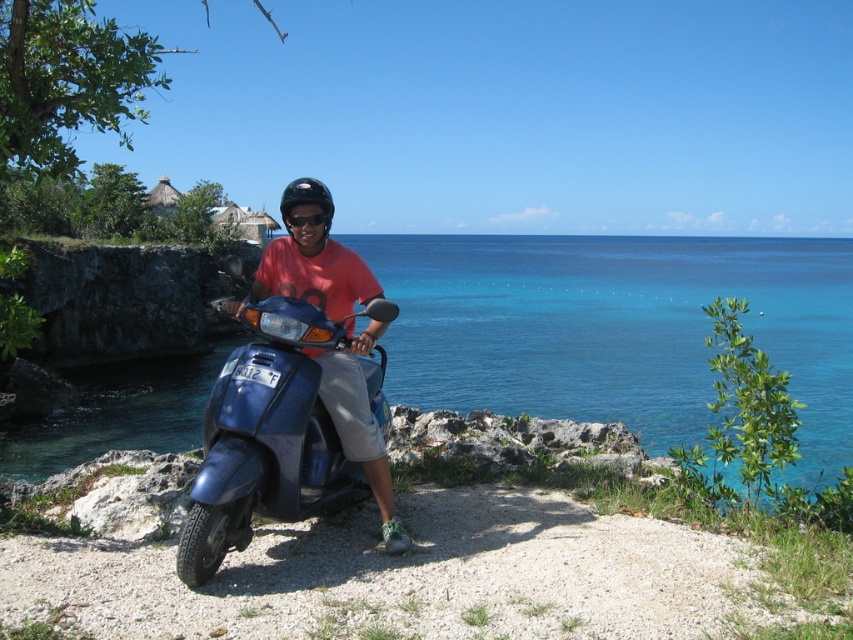
You are planning to cross the blue glossy water at center using the matte blue scooter at center. Given the scooter is 1.2 meters wide, will the scooter fit if the water is wider than the scooter?

The blue glossy water at center is wider than the matte blue scooter at center, so yes, the scooter will fit as the water is wider than the scooter.

You are a photographer trying to capture a photo of the blue glossy water at center and the matte blue scooter at center. Based on their positions, which object should you adjust your camera to focus on first if you want to include both in the frame without moving the camera?

The blue glossy water at center is to the right of matte blue scooter at center. Therefore, you should focus on the matte blue scooter at center first since it is closer to the left side, ensuring both objects remain in the frame when adjusting the camera angle.

You are a delivery person who needs to secure a package on the matte blue scooter at center. The black plastic goggles at center are in the way. Since you can only move one item, which one should you remove to make space for the package?

Since the matte blue scooter at center is taller than the black plastic goggles at center, you should remove the black plastic goggles at center to make space for the package.